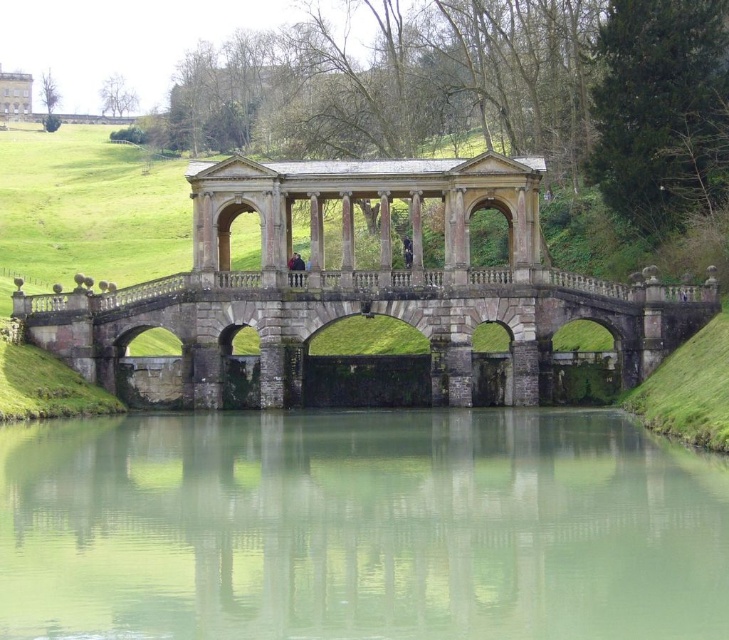
Is green smooth water at center smaller than stone arch bridge at center?

Yes.

Is green smooth water at center shorter than stone arch bridge at center?

Yes.

Where is `green smooth water at center`? The height and width of the screenshot is (640, 729). green smooth water at center is located at coordinates (359, 528).

Can you confirm if green smooth water at center is positioned to the right of white stone palace at upper left?

Indeed, green smooth water at center is positioned on the right side of white stone palace at upper left.

Between green smooth water at center and white stone palace at upper left, which one is positioned lower?

Positioned lower is green smooth water at center.

Does point (620, 522) lie in front of point (7, 97)?

Yes.

The height and width of the screenshot is (640, 729). I want to click on green smooth water at center, so click(359, 528).

Can you confirm if stone arch bridge at center is shorter than white stone palace at upper left?

In fact, stone arch bridge at center may be taller than white stone palace at upper left.

What are the coordinates of `stone arch bridge at center` in the screenshot? It's located at (362, 284).